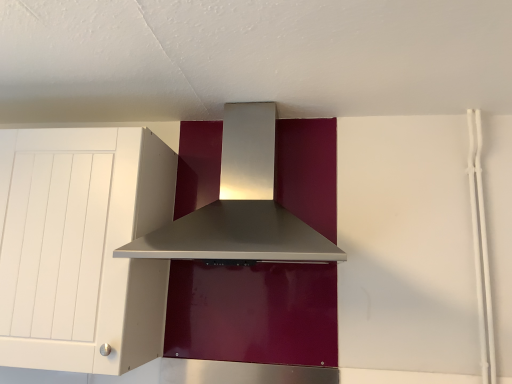
Question: Can you confirm if white matte cabinet at left is positioned to the right of satin silver range hood at center?

Choices:
 (A) no
 (B) yes

Answer: (A)

Question: From the image's perspective, does white matte cabinet at left appear lower than satin silver range hood at center?

Choices:
 (A) no
 (B) yes

Answer: (B)

Question: Considering the relative sizes of white matte cabinet at left and satin silver range hood at center in the image provided, is white matte cabinet at left taller than satin silver range hood at center?

Choices:
 (A) yes
 (B) no

Answer: (A)

Question: Can you confirm if white matte cabinet at left is positioned to the left of satin silver range hood at center?

Choices:
 (A) yes
 (B) no

Answer: (A)

Question: From a real-world perspective, does white matte cabinet at left sit lower than satin silver range hood at center?

Choices:
 (A) no
 (B) yes

Answer: (B)

Question: Considering the relative positions of white matte cabinet at left and satin silver range hood at center in the image provided, is white matte cabinet at left behind satin silver range hood at center?

Choices:
 (A) yes
 (B) no

Answer: (A)

Question: Considering the relative sizes of satin silver range hood at center and white matte cabinet at left in the image provided, is satin silver range hood at center wider than white matte cabinet at left?

Choices:
 (A) no
 (B) yes

Answer: (B)

Question: Is satin silver range hood at center looking in the opposite direction of white matte cabinet at left?

Choices:
 (A) yes
 (B) no

Answer: (B)

Question: Considering the relative positions of satin silver range hood at center and white matte cabinet at left in the image provided, is satin silver range hood at center to the right of white matte cabinet at left from the viewer's perspective?

Choices:
 (A) yes
 (B) no

Answer: (A)

Question: Is the depth of satin silver range hood at center less than that of white matte cabinet at left?

Choices:
 (A) yes
 (B) no

Answer: (A)

Question: Is satin silver range hood at center shorter than white matte cabinet at left?

Choices:
 (A) no
 (B) yes

Answer: (B)

Question: Could you tell me if satin silver range hood at center is turned towards white matte cabinet at left?

Choices:
 (A) no
 (B) yes

Answer: (A)

Question: Is point (93, 349) positioned closer to the camera than point (202, 238)?

Choices:
 (A) farther
 (B) closer

Answer: (B)